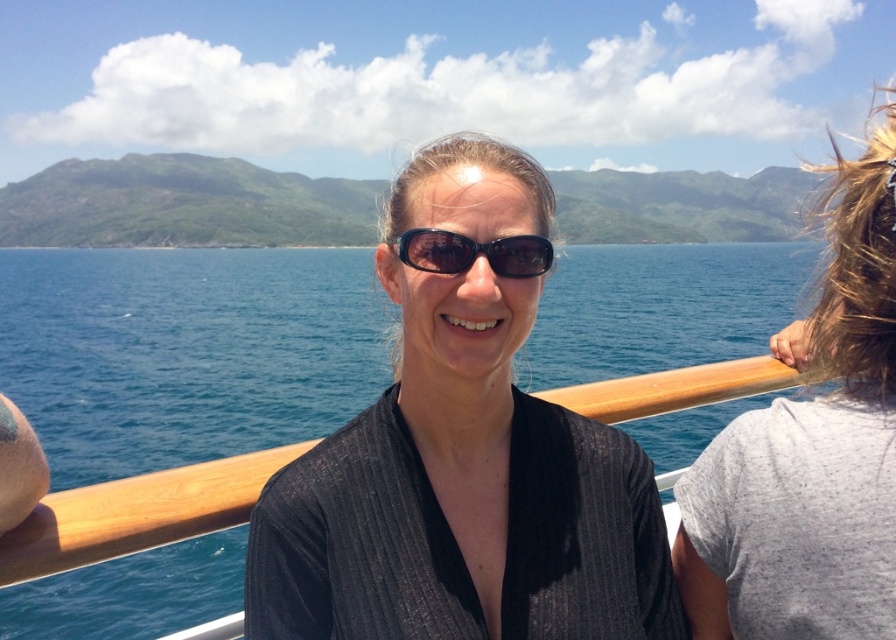
Question: Among these objects, which one is nearest to the camera?

Choices:
 (A) blue water at center
 (B) sunglasses at center
 (C) gray cotton t-shirt at right

Answer: (A)

Question: Can you confirm if gray cotton t-shirt at right is bigger than sunglasses at center?

Choices:
 (A) yes
 (B) no

Answer: (A)

Question: Does black ribbed shirt at center appear on the left side of gray cotton t-shirt at right?

Choices:
 (A) yes
 (B) no

Answer: (A)

Question: Based on their relative distances, which object is nearer to the sunglasses at center?

Choices:
 (A) black ribbed shirt at center
 (B) gray cotton t-shirt at right
 (C) blue water at center

Answer: (A)

Question: Is black ribbed shirt at center closer to camera compared to sunglasses at center?

Choices:
 (A) no
 (B) yes

Answer: (B)

Question: Which point is farther from the camera taking this photo?

Choices:
 (A) (536, 529)
 (B) (209, 371)

Answer: (B)